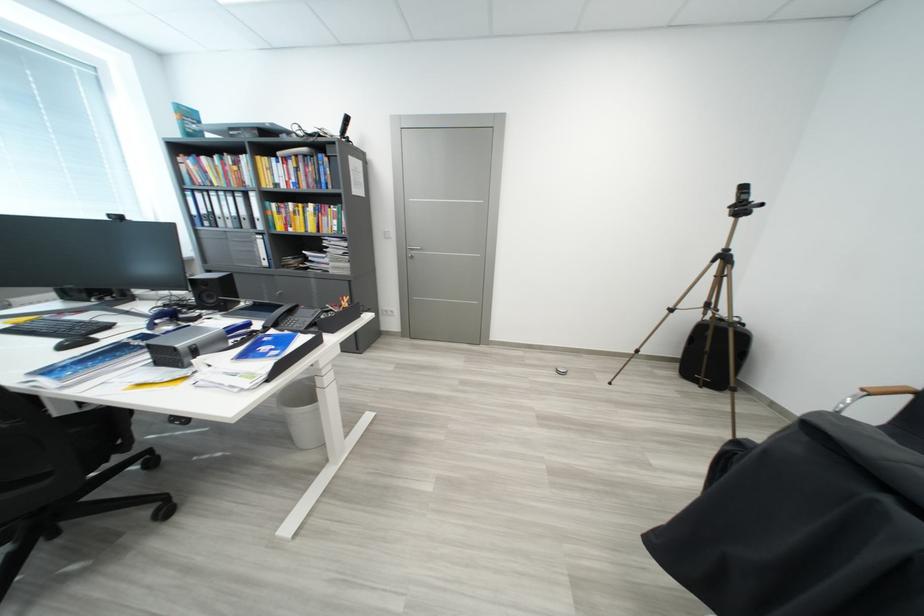
Image resolution: width=924 pixels, height=616 pixels. I want to click on chair sitting surface, so click(91, 430).